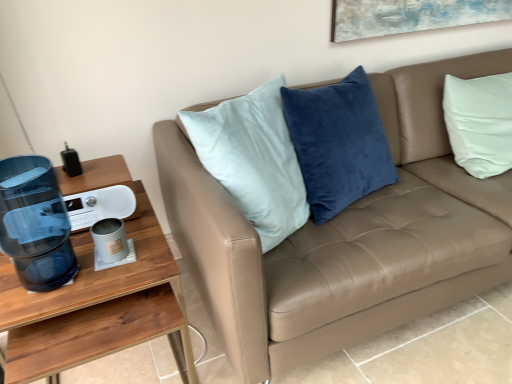
Question: Should I look upward or downward to see matte gray mug at lower left?

Choices:
 (A) up
 (B) down

Answer: (B)

Question: Is wooden desk at left oriented towards tan leather couch at center?

Choices:
 (A) no
 (B) yes

Answer: (A)

Question: Does wooden desk at left have a greater height compared to tan leather couch at center?

Choices:
 (A) no
 (B) yes

Answer: (A)

Question: Is wooden desk at left closer to camera compared to tan leather couch at center?

Choices:
 (A) no
 (B) yes

Answer: (A)

Question: Is wooden desk at left directly adjacent to tan leather couch at center?

Choices:
 (A) yes
 (B) no

Answer: (B)

Question: From the image's perspective, is wooden desk at left under tan leather couch at center?

Choices:
 (A) yes
 (B) no

Answer: (A)

Question: From a real-world perspective, is wooden desk at left below tan leather couch at center?

Choices:
 (A) yes
 (B) no

Answer: (A)

Question: Could you tell me if tan leather couch at center is turned towards wooden desk at left?

Choices:
 (A) no
 (B) yes

Answer: (A)

Question: From a real-world perspective, is tan leather couch at center physically below wooden desk at left?

Choices:
 (A) yes
 (B) no

Answer: (B)

Question: Can we say tan leather couch at center lies outside wooden desk at left?

Choices:
 (A) yes
 (B) no

Answer: (A)

Question: From the image's perspective, is tan leather couch at center below wooden desk at left?

Choices:
 (A) yes
 (B) no

Answer: (B)

Question: Does tan leather couch at center have a lesser height compared to wooden desk at left?

Choices:
 (A) no
 (B) yes

Answer: (A)

Question: Is tan leather couch at center turned away from wooden desk at left?

Choices:
 (A) no
 (B) yes

Answer: (A)

Question: Is matte gray mug at lower left facing away from transparent plastic water cooler at left?

Choices:
 (A) yes
 (B) no

Answer: (B)